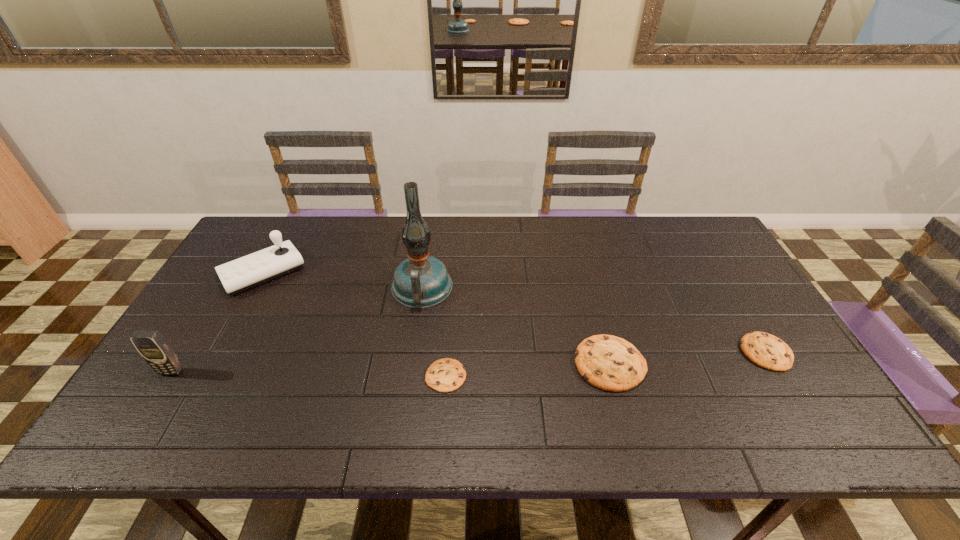
Where is `vacant area in the image that satisfies the following two spatial constraints: 1. on the front face of the second tallest object; 2. on the left side of the leftmost cookie`? vacant area in the image that satisfies the following two spatial constraints: 1. on the front face of the second tallest object; 2. on the left side of the leftmost cookie is located at coordinates (169, 376).